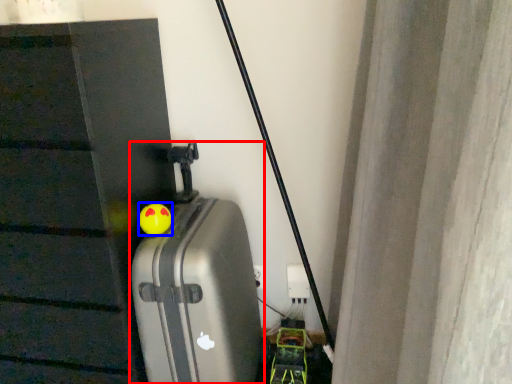
Question: Among these objects, which one is nearest to the camera, suitcase (highlighted by a red box) or toy (highlighted by a blue box)?

Choices:
 (A) suitcase
 (B) toy

Answer: (A)